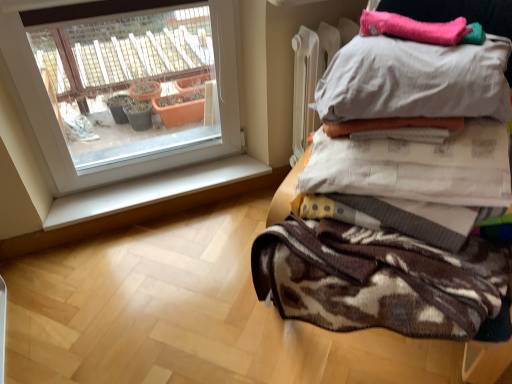
Question: Does point (472, 150) appear closer or farther from the camera than point (301, 67)?

Choices:
 (A) closer
 (B) farther

Answer: (A)

Question: Is brown textured blanket at upper right, marked as the second blanket in a top-to-bottom arrangement, wider or thinner than brown textured blanket at upper right?

Choices:
 (A) wide
 (B) thin

Answer: (B)

Question: Which object is positioned closest to the brown textured blanket at right?

Choices:
 (A) brown textured blanket at upper right
 (B) brown textured blanket at upper right, marked as the second blanket in a top-to-bottom arrangement
 (C) white smooth window sill at lower left
 (D) white cotton pillow at upper right
 (E) pink fuzzy blanket at upper right, which appears as the first blanket when viewed from the top

Answer: (B)

Question: Considering the real-world distances, which object is closest to the white cotton pillow at upper right?

Choices:
 (A) brown textured blanket at right
 (B) white smooth window sill at lower left
 (C) brown textured blanket at upper right, positioned as the first blanket in bottom-to-top order
 (D) brown textured blanket at upper right
 (E) pink fuzzy blanket at upper right, which appears as the first blanket when viewed from the top

Answer: (E)